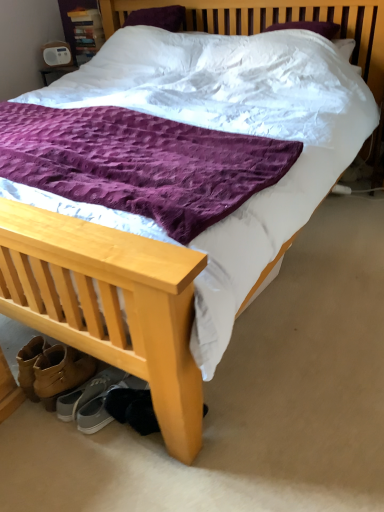
The width and height of the screenshot is (384, 512). I want to click on gray suede sneakers at lower left, which appears as the second footwear when viewed from the right, so click(x=87, y=393).

What do you see at coordinates (87, 393) in the screenshot? This screenshot has width=384, height=512. I see `gray suede sneakers at lower left, which is counted as the first footwear, starting from the left` at bounding box center [87, 393].

What is the approximate width of gray suede sneakers at lower left, which is counted as the first footwear, starting from the left?

The width of gray suede sneakers at lower left, which is counted as the first footwear, starting from the left, is 11.51 inches.

Describe the element at coordinates (133, 409) in the screenshot. I see `dark gray suede shoes at lower left, which appears as the first footwear when viewed from the right` at that location.

Where is `dark gray suede shoes at lower left, which appears as the first footwear when viewed from the right`? This screenshot has height=512, width=384. dark gray suede shoes at lower left, which appears as the first footwear when viewed from the right is located at coordinates (133, 409).

I want to click on gray suede sneakers at lower left, which appears as the second footwear when viewed from the right, so click(87, 393).

Looking at this image, considering the relative positions of dark gray suede shoes at lower left, which appears as the first footwear when viewed from the right, and gray suede sneakers at lower left, which is counted as the first footwear, starting from the left, in the image provided, is dark gray suede shoes at lower left, which appears as the first footwear when viewed from the right, to the left of gray suede sneakers at lower left, which is counted as the first footwear, starting from the left, from the viewer's perspective?

No.

Is the position of dark gray suede shoes at lower left, which appears as the first footwear when viewed from the right, less distant than that of gray suede sneakers at lower left, which appears as the second footwear when viewed from the right?

Answer: That is True.

Does point (139, 392) come behind point (70, 411)?

No, it is not.

From the image's perspective, who appears lower, dark gray suede shoes at lower left, placed as the second footwear when sorted from left to right, or gray suede sneakers at lower left, which appears as the second footwear when viewed from the right?

dark gray suede shoes at lower left, placed as the second footwear when sorted from left to right, appears lower in the image.

From a real-world perspective, relative to gray suede sneakers at lower left, which appears as the second footwear when viewed from the right, is dark gray suede shoes at lower left, which appears as the first footwear when viewed from the right, vertically above or below?

dark gray suede shoes at lower left, which appears as the first footwear when viewed from the right, is above gray suede sneakers at lower left, which appears as the second footwear when viewed from the right.

Looking at this image, is dark gray suede shoes at lower left, placed as the second footwear when sorted from left to right, wider than gray suede sneakers at lower left, which is counted as the first footwear, starting from the left?

No, dark gray suede shoes at lower left, placed as the second footwear when sorted from left to right, is not wider than gray suede sneakers at lower left, which is counted as the first footwear, starting from the left.

Can you confirm if dark gray suede shoes at lower left, placed as the second footwear when sorted from left to right, is taller than gray suede sneakers at lower left, which is counted as the first footwear, starting from the left?

Correct, dark gray suede shoes at lower left, placed as the second footwear when sorted from left to right, is much taller as gray suede sneakers at lower left, which is counted as the first footwear, starting from the left.

Considering the relative sizes of dark gray suede shoes at lower left, which appears as the first footwear when viewed from the right, and gray suede sneakers at lower left, which is counted as the first footwear, starting from the left, in the image provided, is dark gray suede shoes at lower left, which appears as the first footwear when viewed from the right, bigger than gray suede sneakers at lower left, which is counted as the first footwear, starting from the left,?

Correct, dark gray suede shoes at lower left, which appears as the first footwear when viewed from the right, is larger in size than gray suede sneakers at lower left, which is counted as the first footwear, starting from the left.

Is dark gray suede shoes at lower left, which appears as the first footwear when viewed from the right, outside of gray suede sneakers at lower left, which is counted as the first footwear, starting from the left?

Yes, dark gray suede shoes at lower left, which appears as the first footwear when viewed from the right, is located beyond the bounds of gray suede sneakers at lower left, which is counted as the first footwear, starting from the left.

Are dark gray suede shoes at lower left, which appears as the first footwear when viewed from the right, and gray suede sneakers at lower left, which is counted as the first footwear, starting from the left, located far from each other?

dark gray suede shoes at lower left, which appears as the first footwear when viewed from the right, is near gray suede sneakers at lower left, which is counted as the first footwear, starting from the left, not far away.

Could you tell me if dark gray suede shoes at lower left, placed as the second footwear when sorted from left to right, is turned towards gray suede sneakers at lower left, which appears as the second footwear when viewed from the right?

No, dark gray suede shoes at lower left, placed as the second footwear when sorted from left to right, is not turned towards gray suede sneakers at lower left, which appears as the second footwear when viewed from the right.

How different are the orientations of dark gray suede shoes at lower left, placed as the second footwear when sorted from left to right, and gray suede sneakers at lower left, which appears as the second footwear when viewed from the right, in degrees?

They differ by 19.3 degrees in their facing directions.

The width and height of the screenshot is (384, 512). I want to click on footwear above the dark gray suede shoes at lower left, which appears as the first footwear when viewed from the right (from the image's perspective), so click(x=87, y=393).

Between gray suede sneakers at lower left, which is counted as the first footwear, starting from the left, and dark gray suede shoes at lower left, which appears as the first footwear when viewed from the right, which one appears on the left side from the viewer's perspective?

From the viewer's perspective, gray suede sneakers at lower left, which is counted as the first footwear, starting from the left, appears more on the left side.

Looking at this image, does gray suede sneakers at lower left, which is counted as the first footwear, starting from the left, come in front of dark gray suede shoes at lower left, placed as the second footwear when sorted from left to right?

No, it is behind dark gray suede shoes at lower left, placed as the second footwear when sorted from left to right.

Does point (97, 386) come behind point (117, 404)?

Yes, point (97, 386) is farther from viewer.

From the image's perspective, which is above, gray suede sneakers at lower left, which is counted as the first footwear, starting from the left, or dark gray suede shoes at lower left, placed as the second footwear when sorted from left to right?

gray suede sneakers at lower left, which is counted as the first footwear, starting from the left, from the image's perspective.

From a real-world perspective, which object stands above the other?

From a 3D spatial view, dark gray suede shoes at lower left, placed as the second footwear when sorted from left to right, is above.

Which object is wider, gray suede sneakers at lower left, which appears as the second footwear when viewed from the right, or dark gray suede shoes at lower left, which appears as the first footwear when viewed from the right?

Wider between the two is gray suede sneakers at lower left, which appears as the second footwear when viewed from the right.

Who is shorter, gray suede sneakers at lower left, which is counted as the first footwear, starting from the left, or dark gray suede shoes at lower left, which appears as the first footwear when viewed from the right?

gray suede sneakers at lower left, which is counted as the first footwear, starting from the left.

Who is bigger, gray suede sneakers at lower left, which appears as the second footwear when viewed from the right, or dark gray suede shoes at lower left, which appears as the first footwear when viewed from the right?

Bigger between the two is dark gray suede shoes at lower left, which appears as the first footwear when viewed from the right.

Is dark gray suede shoes at lower left, placed as the second footwear when sorted from left to right, surrounded by gray suede sneakers at lower left, which appears as the second footwear when viewed from the right?

No.

Can you see gray suede sneakers at lower left, which appears as the second footwear when viewed from the right, touching dark gray suede shoes at lower left, which appears as the first footwear when viewed from the right?

No, gray suede sneakers at lower left, which appears as the second footwear when viewed from the right, is not making contact with dark gray suede shoes at lower left, which appears as the first footwear when viewed from the right.

Is gray suede sneakers at lower left, which appears as the second footwear when viewed from the right, looking in the opposite direction of dark gray suede shoes at lower left, which appears as the first footwear when viewed from the right?

No, gray suede sneakers at lower left, which appears as the second footwear when viewed from the right,'s orientation is not away from dark gray suede shoes at lower left, which appears as the first footwear when viewed from the right.

I want to click on footwear that appears behind the dark gray suede shoes at lower left, which appears as the first footwear when viewed from the right, so click(87, 393).

In the image, there is a gray suede sneakers at lower left, which appears as the second footwear when viewed from the right. Identify the location of footwear below it (from the image's perspective). (133, 409).

Image resolution: width=384 pixels, height=512 pixels. In order to click on footwear that appears below the dark gray suede shoes at lower left, which appears as the first footwear when viewed from the right (from a real-world perspective) in this screenshot , I will do `click(87, 393)`.